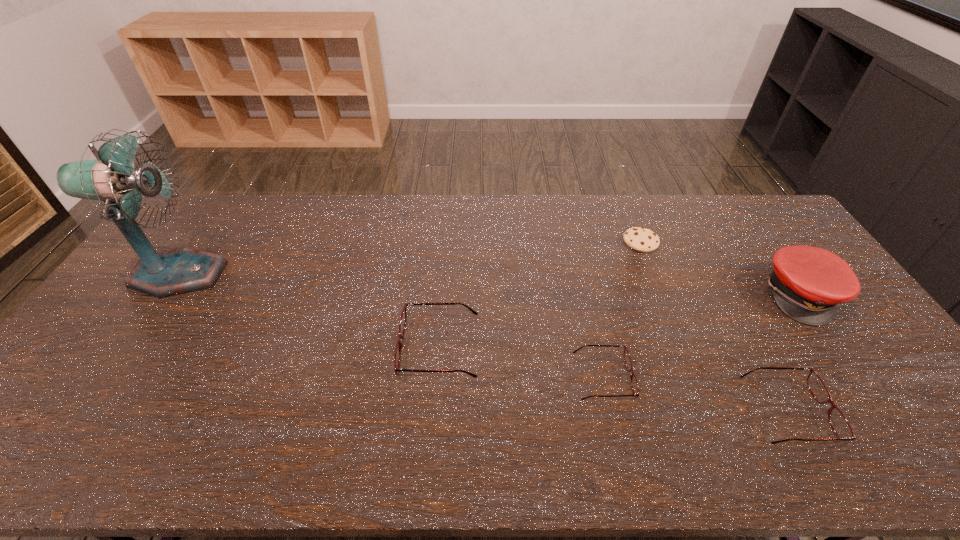
This screenshot has width=960, height=540. I want to click on object located in the left edge section of the desktop, so click(x=111, y=177).

I want to click on object present at the right edge, so click(x=807, y=283).

Locate an element on the screen. This screenshot has width=960, height=540. vacant space at the far edge of the desktop is located at coordinates pyautogui.click(x=623, y=209).

Where is `vacant area at the near edge of the desktop`? This screenshot has height=540, width=960. vacant area at the near edge of the desktop is located at coordinates (368, 404).

Identify the location of vacant region at the left edge of the desktop. This screenshot has height=540, width=960. [110, 367].

The image size is (960, 540). I want to click on free spot at the far right corner of the desktop, so click(x=756, y=215).

Identify the location of vacant region at the near right corner. The height and width of the screenshot is (540, 960). click(x=898, y=388).

Find the location of a particular element. This screenshot has width=960, height=540. vacant space that's between the fourth tallest object and the tallest object is located at coordinates (484, 343).

In order to click on empty space that is in between the rightmost spectacles and the rightmost object in this screenshot , I will do `click(795, 353)`.

Locate an element on the screen. empty location between the second tallest object and the fourth tallest object is located at coordinates (795, 353).